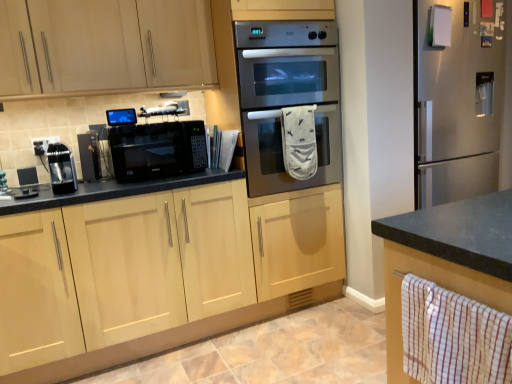
Question: Is black matte microwave at center positioned with its back to satin black microwave at center?

Choices:
 (A) yes
 (B) no

Answer: (B)

Question: Is black matte microwave at center bigger than satin black microwave at center?

Choices:
 (A) no
 (B) yes

Answer: (A)

Question: Does black matte microwave at center lie behind satin black microwave at center?

Choices:
 (A) yes
 (B) no

Answer: (B)

Question: Is black matte microwave at center positioned beyond the bounds of satin black microwave at center?

Choices:
 (A) no
 (B) yes

Answer: (B)

Question: Is satin black microwave at center completely or partially inside black matte microwave at center?

Choices:
 (A) yes
 (B) no

Answer: (B)

Question: From a real-world perspective, is black matte microwave at center located beneath satin black microwave at center?

Choices:
 (A) no
 (B) yes

Answer: (B)

Question: Is black matte microwave at center inside light wood/finish cabinet at center, which is the 2th cabinetry from top to bottom?

Choices:
 (A) no
 (B) yes

Answer: (A)

Question: Is light wood/finish cabinet at center, which ranks as the first cabinetry in bottom-to-top order, not close to black matte microwave at center?

Choices:
 (A) no
 (B) yes

Answer: (A)

Question: Considering the relative positions of light wood/finish cabinet at center, which ranks as the first cabinetry in bottom-to-top order, and black matte microwave at center in the image provided, is light wood/finish cabinet at center, which ranks as the first cabinetry in bottom-to-top order, behind black matte microwave at center?

Choices:
 (A) yes
 (B) no

Answer: (B)

Question: Is light wood/finish cabinet at center, which ranks as the first cabinetry in bottom-to-top order, positioned before black matte microwave at center?

Choices:
 (A) no
 (B) yes

Answer: (B)

Question: Considering the relative sizes of light wood/finish cabinet at center, which is the 2th cabinetry from top to bottom, and black matte microwave at center in the image provided, is light wood/finish cabinet at center, which is the 2th cabinetry from top to bottom, shorter than black matte microwave at center?

Choices:
 (A) yes
 (B) no

Answer: (B)

Question: Is light wood/finish cabinet at center, which ranks as the first cabinetry in bottom-to-top order, located outside black matte microwave at center?

Choices:
 (A) no
 (B) yes

Answer: (B)

Question: Is light wood cabinet at upper left, placed as the 1th cabinetry when sorted from top to bottom, to the right of black plastic electric outlet at upper left from the viewer's perspective?

Choices:
 (A) yes
 (B) no

Answer: (A)